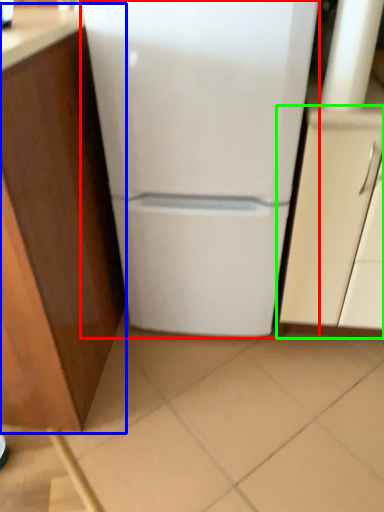
Question: Estimate the real-world distances between objects in this image. Which object is closer to refrigerator (highlighted by a red box), cabinetry (highlighted by a blue box) or cabinetry (highlighted by a green box)?

Choices:
 (A) cabinetry
 (B) cabinetry

Answer: (B)